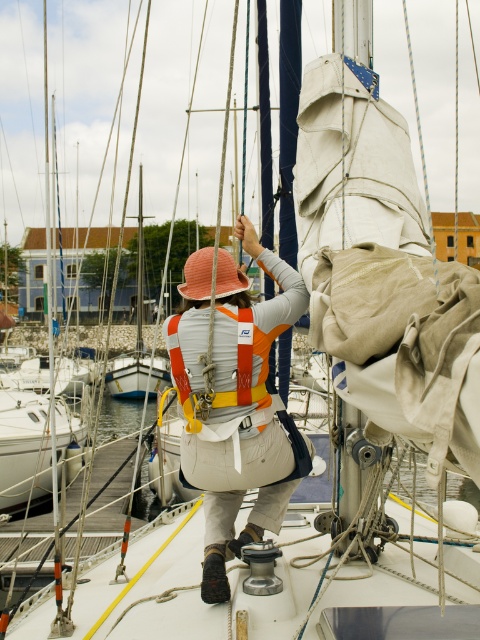
From the picture: Between orange fabric life vest at center and orange fabric safety vest at center, which one is positioned lower?

orange fabric life vest at center

Is orange fabric life vest at center to the right of orange fabric safety vest at center from the viewer's perspective?

Yes, orange fabric life vest at center is to the right of orange fabric safety vest at center.

Identify the location of orange fabric life vest at center. (232, 397).